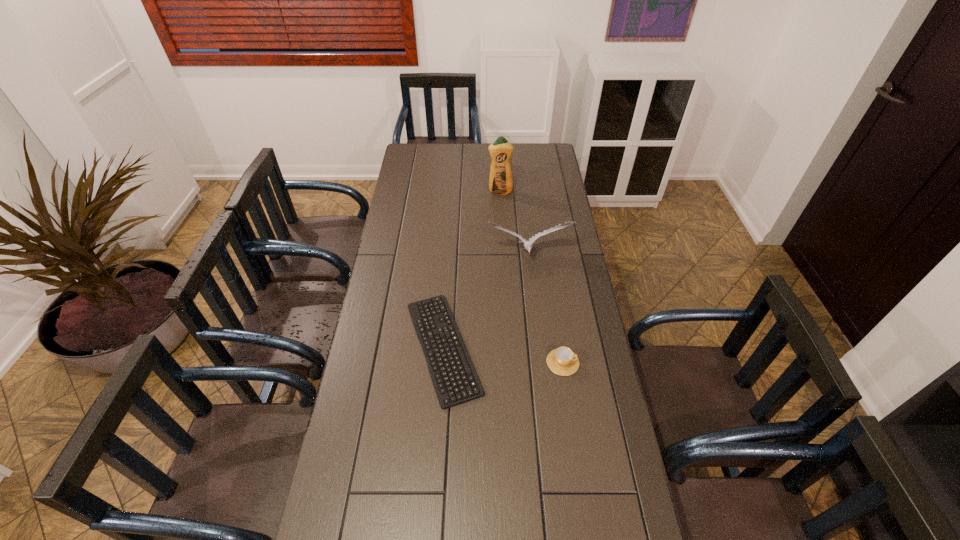
Where is `empty space that is in between the third tallest object and the second tallest object`? empty space that is in between the third tallest object and the second tallest object is located at coordinates (544, 309).

I want to click on vacant area between the detergent and the gull, so click(x=514, y=224).

You are a GUI agent. You are given a task and a screenshot of the screen. Output one action in this format:
    pyautogui.click(x=<x>, y=<y>)
    Task: Click on the free area in between the detergent and the third tallest object
    This screenshot has height=540, width=960.
    Given the screenshot: What is the action you would take?
    click(532, 277)

The height and width of the screenshot is (540, 960). I want to click on empty location between the detergent and the cup, so click(532, 277).

At what (x,y) coordinates should I click in order to perform the action: click on vacant area that lies between the gull and the leftmost object. Please return your answer as a coordinate pair (x, y). Looking at the image, I should click on (485, 301).

Locate an element on the screen. free space between the farthest object and the gull is located at coordinates (514, 224).

Find the location of `empty location between the shortest object and the third tallest object`. empty location between the shortest object and the third tallest object is located at coordinates (503, 355).

This screenshot has width=960, height=540. In order to click on vacant region between the second farthest object and the cup in this screenshot , I will do `click(544, 309)`.

Identify the location of object that stands as the second closest to the farthest object. (455, 380).

Locate which object is the third closest to the second tallest object. Please provide its 2D coordinates. Your answer should be formatted as a tuple, i.e. [(x, y)], where the tuple contains the x and y coordinates of a point satisfying the conditions above.

[(562, 361)]